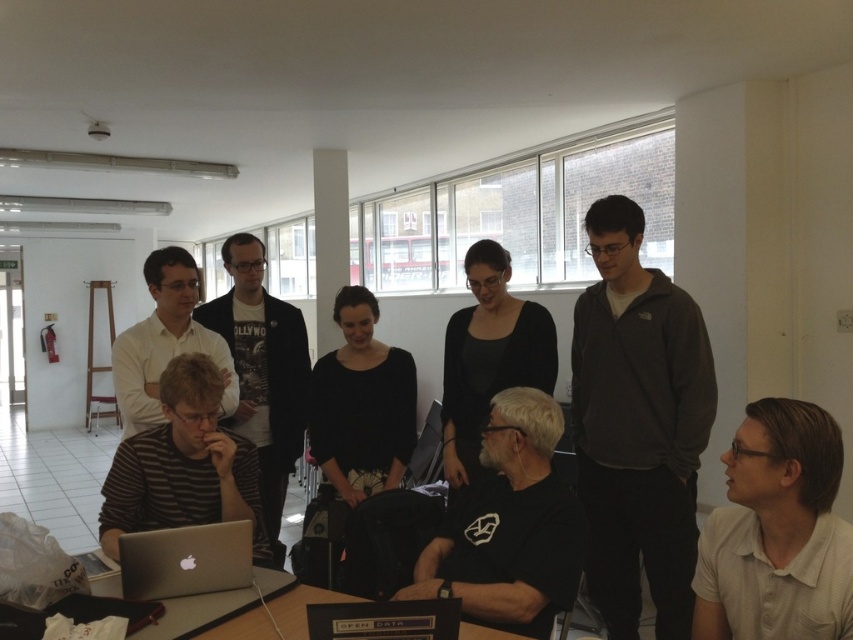
Who is higher up, white matte shirt at center or silver metallic laptop at lower left?

white matte shirt at center is above.

Which is behind, point (180, 307) or point (193, 579)?

The point (180, 307) is more distant.

Between point (175, 289) and point (199, 584), which one is positioned in front?

Point (199, 584) is more forward.

Find the location of `white matte shirt at center`. white matte shirt at center is located at coordinates (165, 342).

Between point (467, 563) and point (154, 492), which one is positioned behind?

Point (154, 492)

Who is lower down, black matte t-shirt at center or striped fabric shirt at left?

Positioned lower is black matte t-shirt at center.

I want to click on black matte t-shirt at center, so click(509, 528).

Locate an element on the screen. black matte t-shirt at center is located at coordinates (509, 528).

Does black matte t-shirt at center appear under silver metallic laptop at lower left?

Incorrect, black matte t-shirt at center is not positioned below silver metallic laptop at lower left.

Is black matte t-shirt at center thinner than silver metallic laptop at lower left?

In fact, black matte t-shirt at center might be wider than silver metallic laptop at lower left.

Where is `black matte t-shirt at center`? The image size is (853, 640). black matte t-shirt at center is located at coordinates (509, 528).

Where is `black matte t-shirt at center`? The width and height of the screenshot is (853, 640). black matte t-shirt at center is located at coordinates (509, 528).